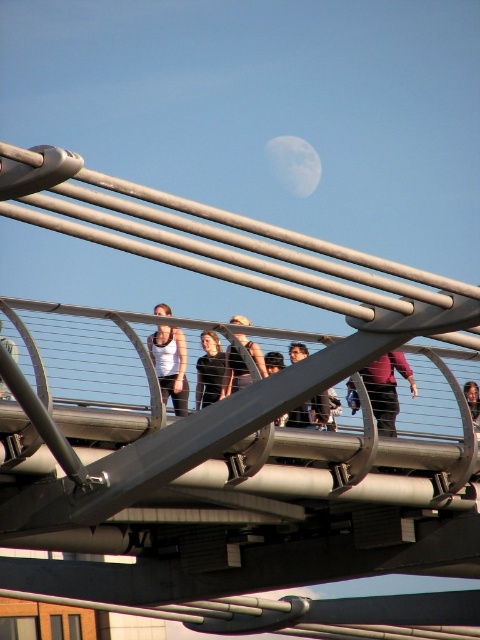
Which is above, dark gray shirt at center or matte black tank top at center?

Positioned higher is dark gray shirt at center.

Does dark gray shirt at center have a lesser width compared to matte black tank top at center?

In fact, dark gray shirt at center might be wider than matte black tank top at center.

The image size is (480, 640). In order to click on dark gray shirt at center in this screenshot , I will do `click(233, 372)`.

Where is `dark gray shirt at center`? dark gray shirt at center is located at coordinates (233, 372).

Who is positioned more to the right, white matte tank top at center or dark gray fabric jacket at center?

From the viewer's perspective, dark gray fabric jacket at center appears more on the right side.

How far apart are white matte tank top at center and dark gray fabric jacket at center?

white matte tank top at center and dark gray fabric jacket at center are 7.12 meters apart from each other.

What do you see at coordinates (170, 365) in the screenshot? I see `white matte tank top at center` at bounding box center [170, 365].

This screenshot has width=480, height=640. In order to click on white matte tank top at center in this screenshot , I will do `click(170, 365)`.

Can you confirm if silver metallic moon at upper center is taller than matte black tank top at center?

Correct, silver metallic moon at upper center is much taller as matte black tank top at center.

Who is lower down, silver metallic moon at upper center or matte black tank top at center?

matte black tank top at center is lower down.

Does point (314, 150) come in front of point (15, 344)?

No, it is not.

In order to click on silver metallic moon at upper center in this screenshot , I will do `click(294, 164)`.